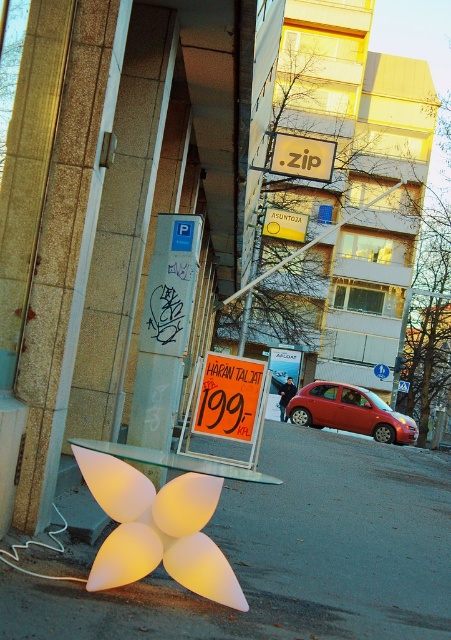
You are standing on the sidewalk and want to take a photo of the translucent plastic flower at lower center. If your camera has a minimum focusing distance of 4 meters, will you need to step back to take a clear photo?

The translucent plastic flower at lower center is 3.94 meters away from the viewer. Since the camera requires a minimum focusing distance of 4 meters, you need to step back slightly to ensure the flower is in focus.

You are a delivery person trying to park your shiny red car at center in a tight space between two parked cars. The translucent plastic flower at lower center is in the way. Can you maneuver your car around it without hitting the flower?

The translucent plastic flower at lower center is wider than the shiny red car at center. Since the flower is wider, it might block the path, making it difficult to maneuver the car without hitting it. You should consider moving the flower or choosing a different parking spot.

You are a pedestrian crossing the street and see the shiny red car at center and the white paper sign at center. Which object is directly above the other?

The white paper sign at center is directly above the shiny red car at center because the car is positioned under the sign.